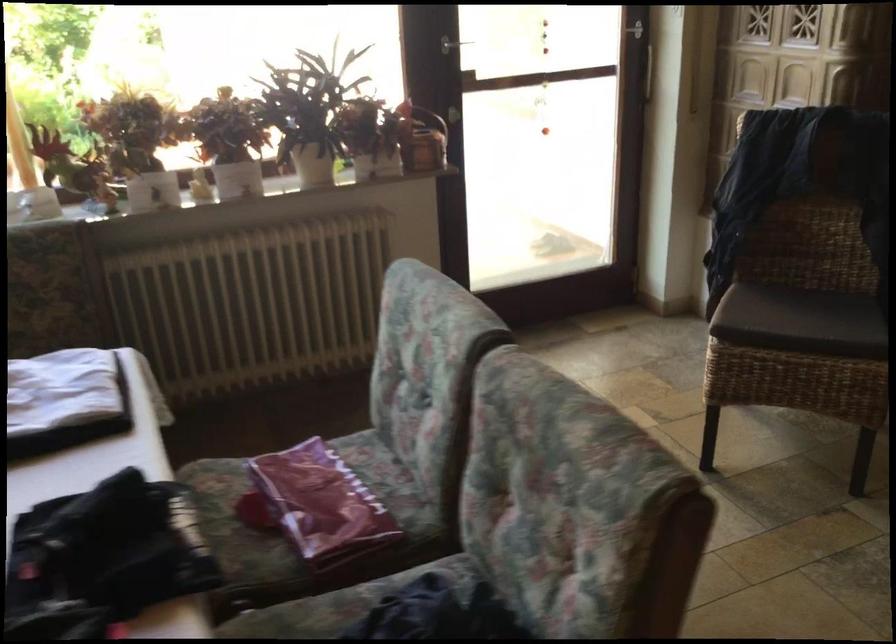
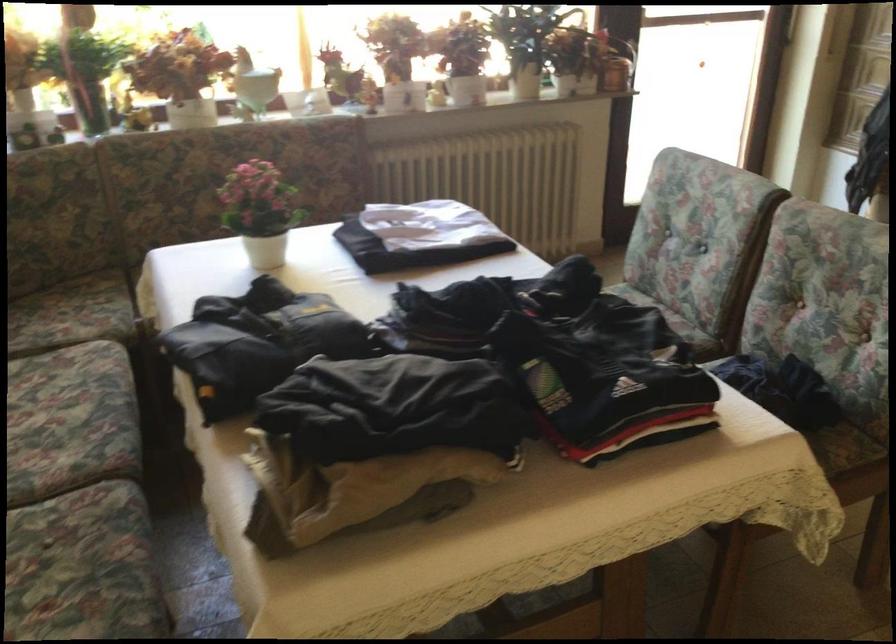
The point at [126,147] is marked in the first image. Where is the corresponding point in the second image?

(397, 57)